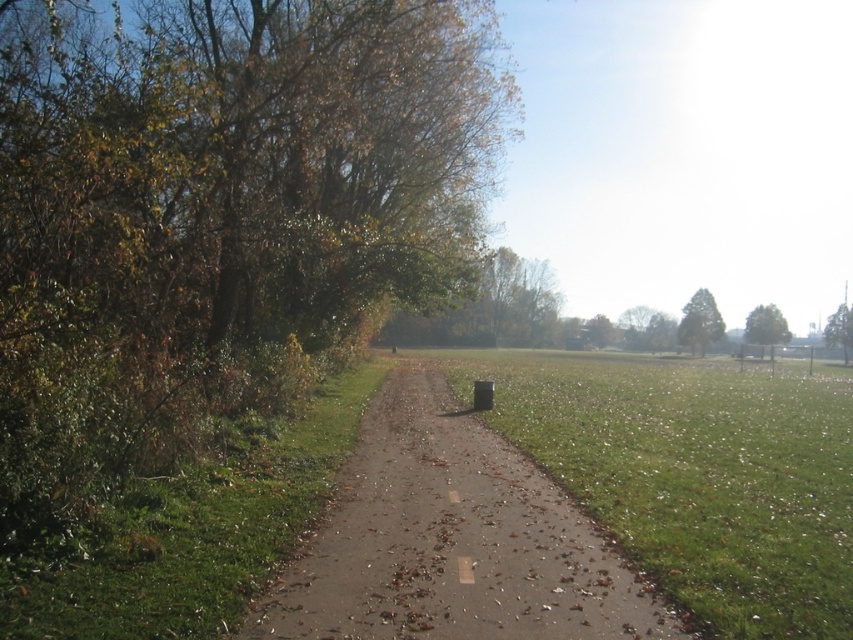
Who is taller, green leafy tree at left or green textured tree at upper right?

Standing taller between the two is green leafy tree at left.

Which is below, green leafy tree at left or green textured tree at upper right?

green textured tree at upper right is below.

This screenshot has width=853, height=640. Describe the element at coordinates (218, 209) in the screenshot. I see `green leafy tree at left` at that location.

Locate an element on the screen. green leafy tree at left is located at coordinates (218, 209).

Can you confirm if green leafy tree at upper right is smaller than green leafy tree at right?

Yes, green leafy tree at upper right is smaller than green leafy tree at right.

Which of these two, green leafy tree at upper right or green leafy tree at right, stands shorter?

Standing shorter between the two is green leafy tree at upper right.

Which is in front, point (746, 324) or point (846, 358)?

Positioned in front is point (846, 358).

This screenshot has height=640, width=853. I want to click on green leafy tree at upper right, so click(x=764, y=326).

Between brown dirt path at center and green leafy tree at right, which one has less height?

Standing shorter between the two is brown dirt path at center.

Between point (451, 410) and point (849, 346), which one is positioned in front?

Point (451, 410) is in front.

Consider the image. Who is more distant from viewer, [479,493] or [840,324]?

Point [840,324]

This screenshot has height=640, width=853. What are the coordinates of `brown dirt path at center` in the screenshot? It's located at (451, 541).